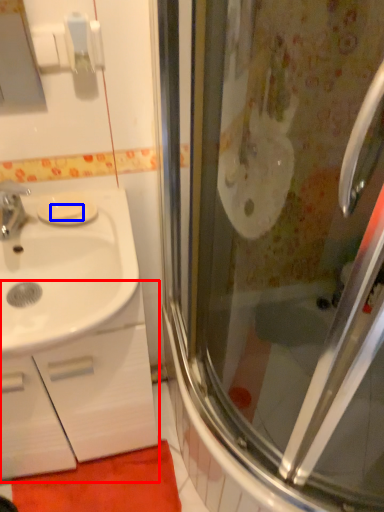
Question: Which object appears closest to the camera in this image, bathroom cabinet (highlighted by a red box) or soap (highlighted by a blue box)?

Choices:
 (A) bathroom cabinet
 (B) soap

Answer: (A)